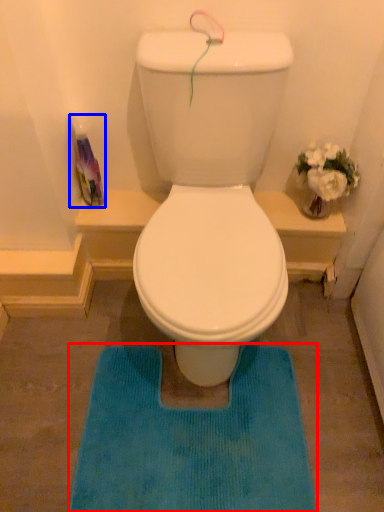
Question: Which object is closer to the camera taking this photo, bath mat (highlighted by a red box) or bottle (highlighted by a blue box)?

Choices:
 (A) bath mat
 (B) bottle

Answer: (A)